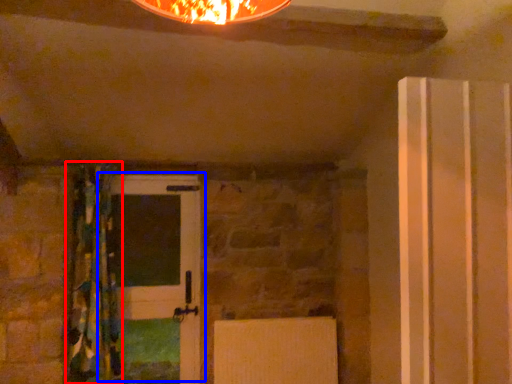
Question: Which object is further to the camera taking this photo, curtain (highlighted by a red box) or door (highlighted by a blue box)?

Choices:
 (A) curtain
 (B) door

Answer: (B)